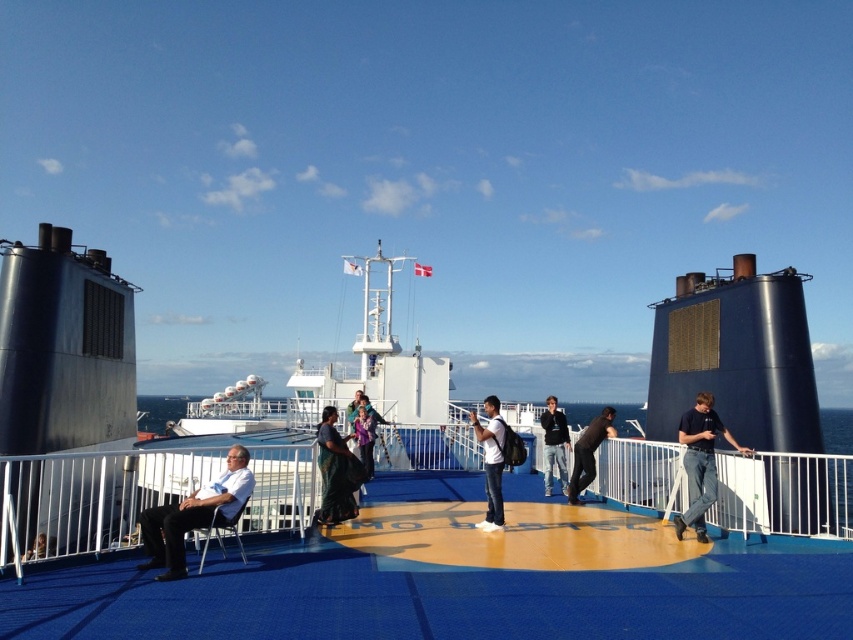
You are standing on the ship deck and want to move from the first point to the second point. Which direction should you move to get from point (363, 436) to point (206, 529)?

To move from point (363, 436) to point (206, 529), you should move forward since point (363, 436) is behind point (206, 529).

You are a photographer on the ship deck and want to capture a photo of the matte purple dress at center and the metallic blue chair at lower left. Based on their positions, which object is closer to the camera?

The matte purple dress at center is above the metallic blue chair at lower left, so it is closer to the camera.